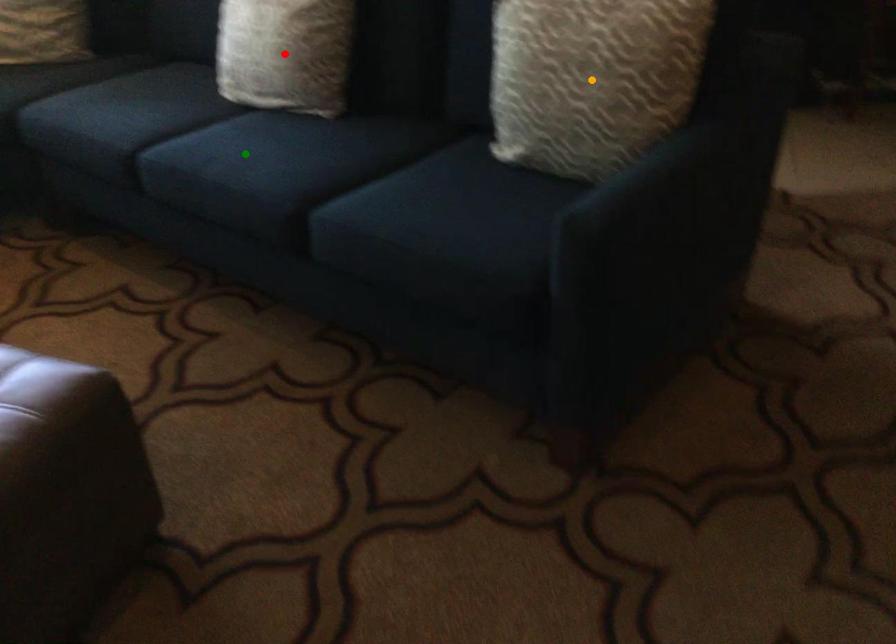
Order these from nearest to farthest:
- orange point
- green point
- red point

orange point
green point
red point